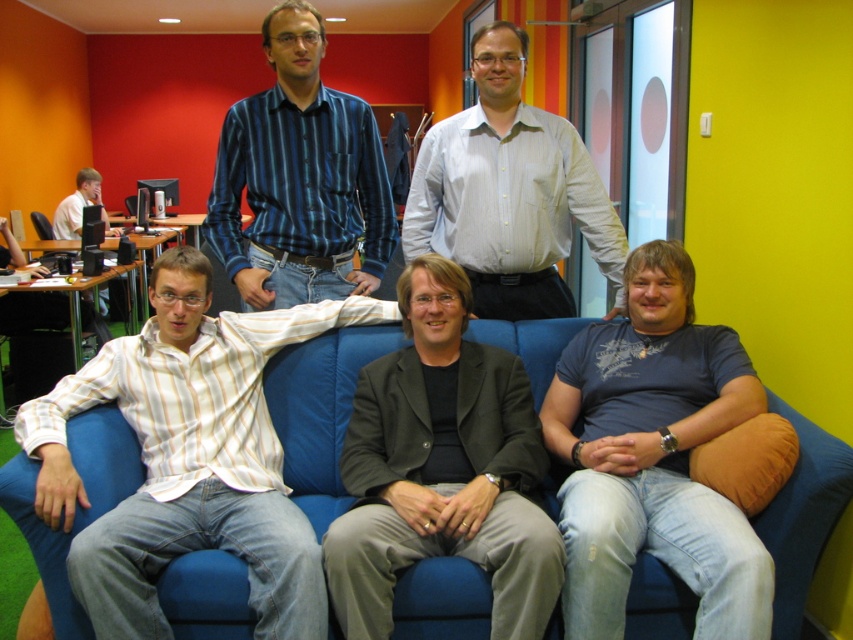
Question: Can you confirm if blue striped shirt at upper center is positioned to the right of matte black laptop at left?

Choices:
 (A) no
 (B) yes

Answer: (B)

Question: Among these points, which one is farthest from the camera?

Choices:
 (A) (328, 120)
 (B) (96, 189)
 (C) (602, 412)
 (D) (483, 97)

Answer: (B)

Question: Which of the following is the closest to the observer?

Choices:
 (A) (71, 214)
 (B) (637, 390)
 (C) (450, 193)
 (D) (91, 516)

Answer: (D)

Question: Is dark gray suit at center wider than matte black monitor at left?

Choices:
 (A) yes
 (B) no

Answer: (A)

Question: Considering the relative positions of white striped shirt at center and blue fabric couch at center in the image provided, where is white striped shirt at center located with respect to blue fabric couch at center?

Choices:
 (A) right
 (B) left

Answer: (B)

Question: Which point is closer to the camera taking this photo?

Choices:
 (A) [x=518, y=353]
 (B) [x=252, y=406]

Answer: (B)